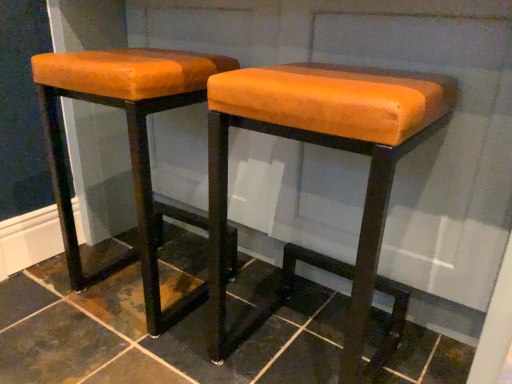
Identify the location of vacant area that lies between orange leather stool at left, which is counted as the first stool, starting from the left, and orange leather stool at center, positioned as the 2th stool in left-to-right order. (226, 318).